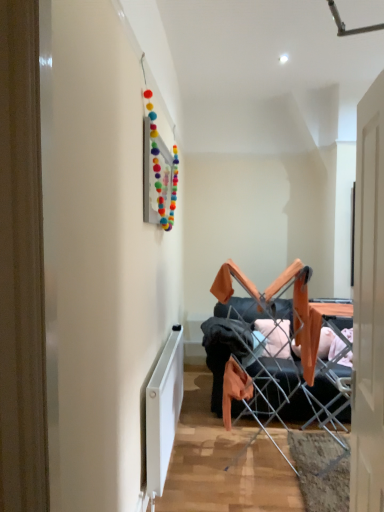
Question: Is white matte radiator at lower left in contact with orange fabric chair at center?

Choices:
 (A) no
 (B) yes

Answer: (A)

Question: Can you confirm if white matte radiator at lower left is shorter than orange fabric chair at center?

Choices:
 (A) yes
 (B) no

Answer: (A)

Question: From a real-world perspective, is white matte radiator at lower left over orange fabric chair at center?

Choices:
 (A) yes
 (B) no

Answer: (B)

Question: Does white matte radiator at lower left turn towards orange fabric chair at center?

Choices:
 (A) yes
 (B) no

Answer: (A)

Question: Is orange fabric chair at center inside white matte radiator at lower left?

Choices:
 (A) no
 (B) yes

Answer: (A)

Question: Is white matte radiator at lower left to the right of orange fabric chair at center from the viewer's perspective?

Choices:
 (A) yes
 (B) no

Answer: (B)

Question: Can you see orange fabric chair at center touching white matte radiator at lower left?

Choices:
 (A) yes
 (B) no

Answer: (B)

Question: Considering the relative sizes of orange fabric chair at center and white matte radiator at lower left in the image provided, is orange fabric chair at center taller than white matte radiator at lower left?

Choices:
 (A) yes
 (B) no

Answer: (A)

Question: Does orange fabric chair at center have a greater width compared to white matte radiator at lower left?

Choices:
 (A) no
 (B) yes

Answer: (B)

Question: Does orange fabric chair at center appear on the left side of white matte radiator at lower left?

Choices:
 (A) yes
 (B) no

Answer: (B)

Question: Can you confirm if orange fabric chair at center is shorter than white matte radiator at lower left?

Choices:
 (A) no
 (B) yes

Answer: (A)

Question: Would you consider orange fabric chair at center to be distant from white matte radiator at lower left?

Choices:
 (A) yes
 (B) no

Answer: (B)

Question: Relative to orange fabric chair at center, is white matte radiator at lower left in front or behind?

Choices:
 (A) front
 (B) behind

Answer: (A)